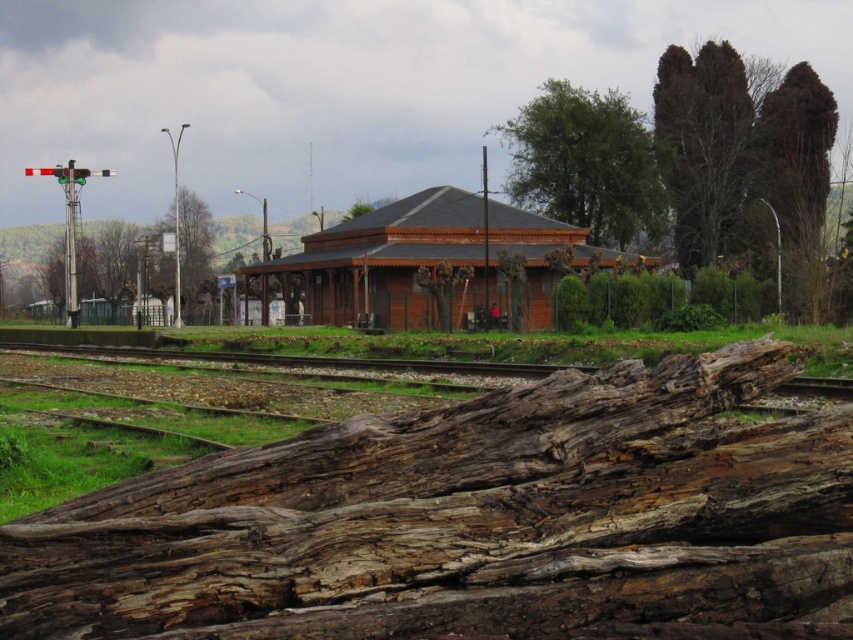
Question: Which point is closer to the camera?

Choices:
 (A) brown wooden railway station at center
 (B) weathered wood log at center
 (C) green leafy tree at upper center

Answer: (B)

Question: Among these points, which one is farthest from the camera?

Choices:
 (A) (570, 115)
 (B) (190, 211)
 (C) (488, 484)

Answer: (B)

Question: Which point is closer to the camera taking this photo?

Choices:
 (A) (621, 161)
 (B) (541, 316)
 (C) (624, 371)
 (D) (167, 214)

Answer: (C)

Question: Does brown wooden railway station at center come behind green leafy tree at upper right?

Choices:
 (A) no
 (B) yes

Answer: (A)

Question: Observing the image, what is the correct spatial positioning of weathered wood log at center in reference to brown wooden railway station at center?

Choices:
 (A) right
 (B) left

Answer: (B)

Question: Is weathered wood log at center below green leafy tree at upper center?

Choices:
 (A) yes
 (B) no

Answer: (A)